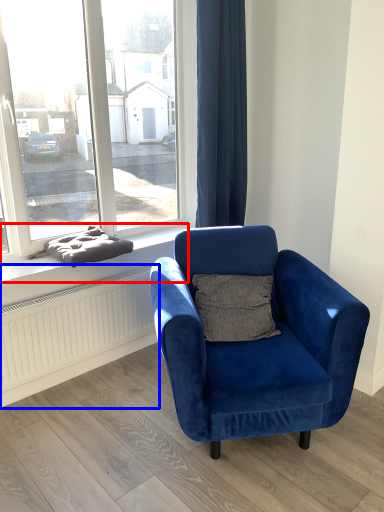
Question: Which of the following is the closest to the observer, window sill (highlighted by a red box) or radiator (highlighted by a blue box)?

Choices:
 (A) window sill
 (B) radiator

Answer: (A)